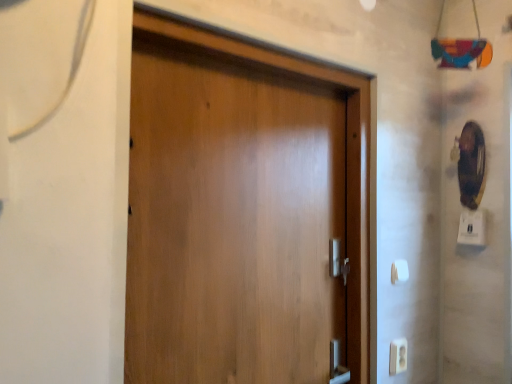
Question: Is white plastic light switch at lower right, marked as the 2th light switch in a top-to-bottom arrangement, located within white plastic light switch at right, which is the 1th light switch from right to left?

Choices:
 (A) no
 (B) yes

Answer: (A)

Question: Does white plastic light switch at right, which is the 1th light switch from right to left, have a greater height compared to white plastic light switch at lower right, the second light switch from the right?

Choices:
 (A) yes
 (B) no

Answer: (A)

Question: From a real-world perspective, is white plastic light switch at right, which appears as the 2th light switch when viewed from the left, under white plastic light switch at lower right, the second light switch from the right?

Choices:
 (A) no
 (B) yes

Answer: (A)

Question: Is white plastic light switch at right, which is the 1th light switch from right to left, not close to white plastic light switch at lower right, positioned as the 1th light switch in bottom-to-top order?

Choices:
 (A) yes
 (B) no

Answer: (B)

Question: Are white plastic light switch at right, arranged as the 1th light switch when viewed from the top, and white plastic light switch at lower right, marked as the 2th light switch in a top-to-bottom arrangement, beside each other?

Choices:
 (A) no
 (B) yes

Answer: (A)

Question: Considering the positions of point (483, 241) and point (152, 249), is point (483, 241) closer or farther from the camera than point (152, 249)?

Choices:
 (A) closer
 (B) farther

Answer: (B)

Question: Relative to wooden door at center, is white plastic light switch at right, which appears as the 2th light switch when viewed from the left, in front or behind?

Choices:
 (A) behind
 (B) front

Answer: (A)

Question: From a real-world perspective, is white plastic light switch at right, which ranks as the 2th light switch in bottom-to-top order, above or below wooden door at center?

Choices:
 (A) above
 (B) below

Answer: (A)

Question: From the image's perspective, is white plastic light switch at right, which ranks as the 2th light switch in bottom-to-top order, above or below wooden door at center?

Choices:
 (A) above
 (B) below

Answer: (B)

Question: From a real-world perspective, relative to white plastic light switch at right, which is the 1th light switch from right to left, is wooden door at center vertically above or below?

Choices:
 (A) below
 (B) above

Answer: (A)

Question: From the image's perspective, is wooden door at center above or below white plastic light switch at right, which is the 1th light switch from right to left?

Choices:
 (A) below
 (B) above

Answer: (B)

Question: Looking at the image, does wooden door at center seem bigger or smaller compared to white plastic light switch at right, which is the 1th light switch from right to left?

Choices:
 (A) small
 (B) big

Answer: (B)

Question: Considering the positions of point (340, 127) and point (459, 236), is point (340, 127) closer or farther from the camera than point (459, 236)?

Choices:
 (A) farther
 (B) closer

Answer: (B)

Question: In terms of width, does white plastic electric outlet at lower right look wider or thinner when compared to white plastic light switch at lower right, marked as the 2th light switch in a top-to-bottom arrangement?

Choices:
 (A) thin
 (B) wide

Answer: (A)

Question: Considering the positions of white plastic electric outlet at lower right and white plastic light switch at lower right, marked as the 2th light switch in a top-to-bottom arrangement, in the image, is white plastic electric outlet at lower right bigger or smaller than white plastic light switch at lower right, marked as the 2th light switch in a top-to-bottom arrangement,?

Choices:
 (A) small
 (B) big

Answer: (B)